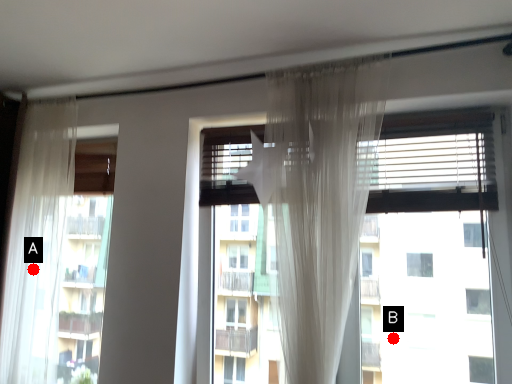
Question: Two points are circled on the image, labeled by A and B beside each circle. Which point is further to the camera?

Choices:
 (A) A is further
 (B) B is further

Answer: (A)